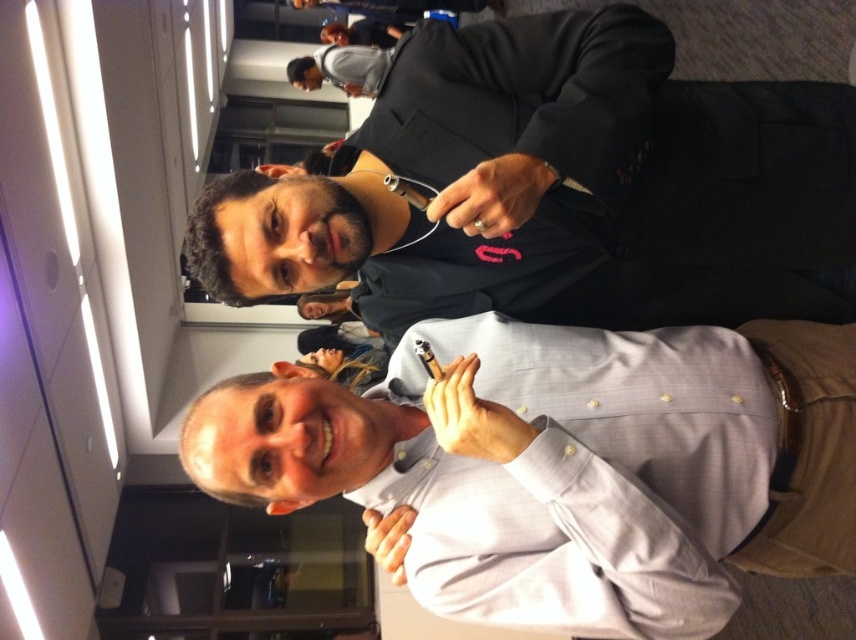
Question: Which point appears farthest from the camera in this image?

Choices:
 (A) (603, 131)
 (B) (847, 461)

Answer: (B)

Question: Does black matte suit at center have a greater width compared to white button-down shirt at center?

Choices:
 (A) yes
 (B) no

Answer: (A)

Question: Which point appears farthest from the camera in this image?

Choices:
 (A) (593, 24)
 (B) (589, 499)

Answer: (A)

Question: Can you confirm if black matte suit at center is thinner than white button-down shirt at center?

Choices:
 (A) no
 (B) yes

Answer: (A)

Question: Can you confirm if black matte suit at center is bigger than white button-down shirt at center?

Choices:
 (A) yes
 (B) no

Answer: (A)

Question: Among these objects, which one is nearest to the camera?

Choices:
 (A) white button-down shirt at center
 (B) black matte suit at center

Answer: (B)